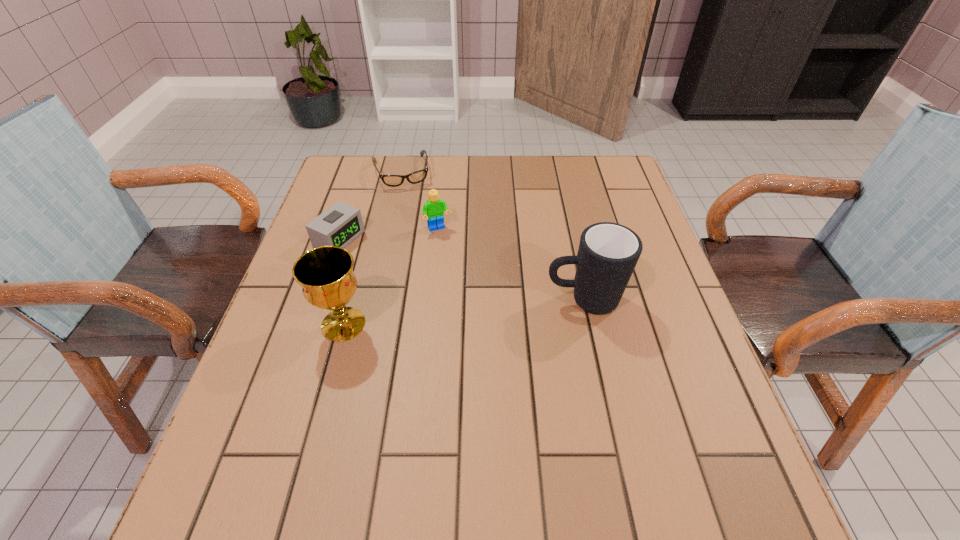
Locate an element on the screen. The height and width of the screenshot is (540, 960). object located in the far edge section of the desktop is located at coordinates (418, 176).

Where is `chalice that is positioned at the left edge`? The height and width of the screenshot is (540, 960). chalice that is positioned at the left edge is located at coordinates (325, 273).

Locate an element on the screen. The width and height of the screenshot is (960, 540). alarm clock at the left edge is located at coordinates (341, 224).

At what (x,y) coordinates should I click in order to perform the action: click on spectacles present at the left edge. Please return your answer as a coordinate pair (x, y). Looking at the image, I should click on (418, 176).

Locate an element on the screen. The height and width of the screenshot is (540, 960). object present at the right edge is located at coordinates (608, 252).

Where is `object located at the far left corner`? This screenshot has width=960, height=540. object located at the far left corner is located at coordinates (418, 176).

The image size is (960, 540). In the image, there is a desktop. Identify the location of vacant space at the far edge. (406, 186).

At what (x,y) coordinates should I click in order to perform the action: click on vacant space at the near edge of the desktop. Please return your answer as a coordinate pair (x, y). Image resolution: width=960 pixels, height=540 pixels. Looking at the image, I should click on (383, 433).

You are a GUI agent. You are given a task and a screenshot of the screen. Output one action in this format:
    pyautogui.click(x=<x>, y=<y>)
    Task: Click on the vacant space at the far left corner
    The image size is (960, 540).
    Given the screenshot: What is the action you would take?
    pyautogui.click(x=341, y=172)

The height and width of the screenshot is (540, 960). In the image, there is a desktop. What are the coordinates of `vacant space at the far right corner` in the screenshot? It's located at (628, 199).